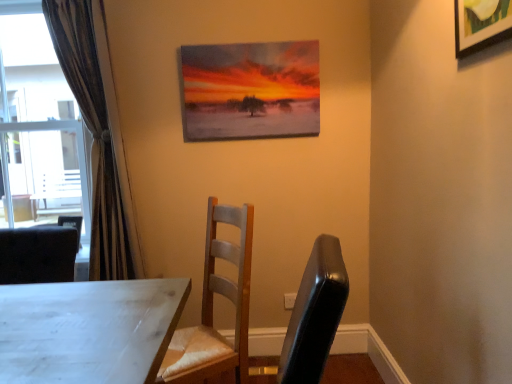
Question: Can you confirm if wooden picture frame at upper right, acting as the second picture frame starting from the left, is taller than oil painting at upper center, which is counted as the first picture frame, starting from the left?

Choices:
 (A) yes
 (B) no

Answer: (B)

Question: Is wooden picture frame at upper right, acting as the second picture frame starting from the left, positioned beyond the bounds of oil painting at upper center, the 1th picture frame positioned from the back?

Choices:
 (A) yes
 (B) no

Answer: (A)

Question: Is oil painting at upper center, which is counted as the first picture frame, starting from the left, completely or partially inside wooden picture frame at upper right, which ranks as the first picture frame in front-to-back order?

Choices:
 (A) yes
 (B) no

Answer: (B)

Question: Does wooden picture frame at upper right, acting as the second picture frame starting from the left, have a smaller size compared to oil painting at upper center, acting as the second picture frame starting from the front?

Choices:
 (A) no
 (B) yes

Answer: (B)

Question: Can you confirm if wooden picture frame at upper right, which appears as the 1th picture frame when viewed from the right, is wider than oil painting at upper center, the 1th picture frame positioned from the back?

Choices:
 (A) no
 (B) yes

Answer: (A)

Question: From the image's perspective, is wooden chair at center located above or below brown textured curtain at left?

Choices:
 (A) above
 (B) below

Answer: (B)

Question: Is wooden chair at center in front of or behind brown textured curtain at left in the image?

Choices:
 (A) behind
 (B) front

Answer: (B)

Question: Considering the positions of wooden chair at center and brown textured curtain at left in the image, is wooden chair at center taller or shorter than brown textured curtain at left?

Choices:
 (A) short
 (B) tall

Answer: (A)

Question: Considering the positions of wooden chair at center and brown textured curtain at left in the image, is wooden chair at center bigger or smaller than brown textured curtain at left?

Choices:
 (A) big
 (B) small

Answer: (A)

Question: Considering their positions, is wooden chair at center located in front of or behind wooden picture frame at upper right, which is the 2th picture frame from back to front?

Choices:
 (A) front
 (B) behind

Answer: (B)

Question: In the image, is wooden chair at center on the left side or the right side of wooden picture frame at upper right, which appears as the 1th picture frame when viewed from the right?

Choices:
 (A) left
 (B) right

Answer: (A)

Question: From a real-world perspective, is wooden chair at center physically located above or below wooden picture frame at upper right, which appears as the 1th picture frame when viewed from the right?

Choices:
 (A) below
 (B) above

Answer: (A)

Question: From the image's perspective, is wooden chair at center above or below wooden picture frame at upper right, which appears as the 1th picture frame when viewed from the right?

Choices:
 (A) above
 (B) below

Answer: (B)

Question: Choose the correct answer: Is oil painting at upper center, the 1th picture frame positioned from the back, inside wooden picture frame at upper right, acting as the second picture frame starting from the left, or outside it?

Choices:
 (A) inside
 (B) outside

Answer: (B)

Question: In terms of width, does oil painting at upper center, which appears as the 2th picture frame when viewed from the right, look wider or thinner when compared to wooden picture frame at upper right, acting as the second picture frame starting from the left?

Choices:
 (A) thin
 (B) wide

Answer: (B)